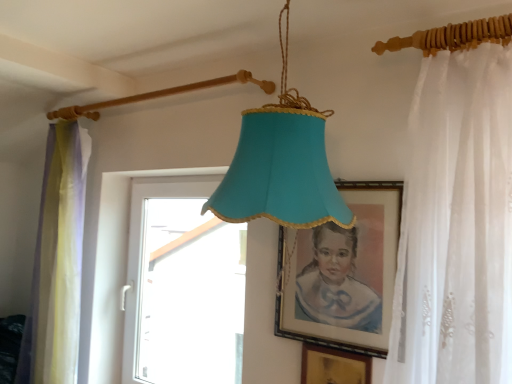
Question: Is white sheer curtain at right, marked as the second curtain in a back-to-front arrangement, taller than gold metallic picture frame at lower center, marked as the 2th picture frame in a top-to-bottom arrangement?

Choices:
 (A) yes
 (B) no

Answer: (A)

Question: Is the depth of white sheer curtain at right, marked as the second curtain in a left-to-right arrangement, greater than that of gold metallic picture frame at lower center, marked as the 2th picture frame in a top-to-bottom arrangement?

Choices:
 (A) yes
 (B) no

Answer: (B)

Question: Can you confirm if white sheer curtain at right, the first curtain viewed from the right, is bigger than gold metallic picture frame at lower center, marked as the 2th picture frame in a top-to-bottom arrangement?

Choices:
 (A) yes
 (B) no

Answer: (A)

Question: Can you confirm if white sheer curtain at right, the first curtain viewed from the right, is positioned to the left of gold metallic picture frame at lower center, marked as the 2th picture frame in a top-to-bottom arrangement?

Choices:
 (A) yes
 (B) no

Answer: (B)

Question: Is white sheer curtain at right, marked as the second curtain in a back-to-front arrangement, closer to camera compared to gold metallic picture frame at lower center, marked as the 2th picture frame in a top-to-bottom arrangement?

Choices:
 (A) yes
 (B) no

Answer: (A)

Question: In terms of height, does white sheer curtain at right, which appears as the 1th curtain when viewed from the front, look taller or shorter compared to translucent yellowish-green curtain at left, the 1th curtain in the left-to-right sequence?

Choices:
 (A) short
 (B) tall

Answer: (A)

Question: Is white sheer curtain at right, marked as the second curtain in a back-to-front arrangement, inside or outside of translucent yellowish-green curtain at left, which ranks as the second curtain in right-to-left order?

Choices:
 (A) inside
 (B) outside

Answer: (B)

Question: In the image, is white sheer curtain at right, marked as the second curtain in a left-to-right arrangement, positioned in front of or behind translucent yellowish-green curtain at left, which is counted as the first curtain, starting from the back?

Choices:
 (A) behind
 (B) front

Answer: (B)

Question: In terms of width, does white sheer curtain at right, the first curtain viewed from the right, look wider or thinner when compared to translucent yellowish-green curtain at left, which is counted as the first curtain, starting from the back?

Choices:
 (A) wide
 (B) thin

Answer: (A)

Question: Considering the relative positions of gold metallic picture frame at lower center, the 1th picture frame ordered from the bottom, and translucent yellowish-green curtain at left, which ranks as the second curtain in right-to-left order, in the image provided, is gold metallic picture frame at lower center, the 1th picture frame ordered from the bottom, to the left or to the right of translucent yellowish-green curtain at left, which ranks as the second curtain in right-to-left order,?

Choices:
 (A) left
 (B) right

Answer: (B)

Question: Considering their positions, is gold metallic picture frame at lower center, the 1th picture frame ordered from the bottom, located in front of or behind translucent yellowish-green curtain at left, the 1th curtain in the left-to-right sequence?

Choices:
 (A) behind
 (B) front

Answer: (B)

Question: Is gold metallic picture frame at lower center, the 1th picture frame ordered from the bottom, inside the boundaries of translucent yellowish-green curtain at left, which ranks as the second curtain in right-to-left order, or outside?

Choices:
 (A) inside
 (B) outside

Answer: (B)

Question: From the image's perspective, is gold metallic picture frame at lower center, the 1th picture frame ordered from the bottom, above or below translucent yellowish-green curtain at left, arranged as the second curtain when viewed from the front?

Choices:
 (A) below
 (B) above

Answer: (A)

Question: Based on their sizes in the image, would you say matte gold picture frame at center, the 1th picture frame when ordered from top to bottom, is bigger or smaller than white plastic window at center?

Choices:
 (A) small
 (B) big

Answer: (A)

Question: From a real-world perspective, relative to white plastic window at center, is matte gold picture frame at center, which ranks as the second picture frame in bottom-to-top order, vertically above or below?

Choices:
 (A) above
 (B) below

Answer: (A)